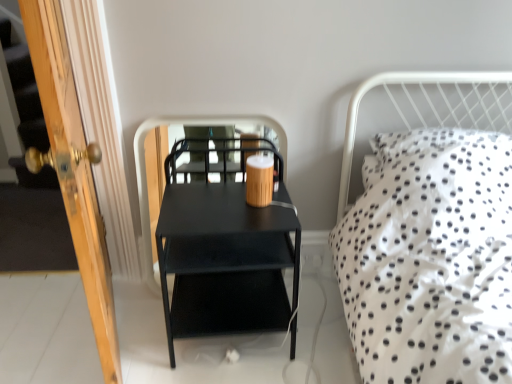
You are a GUI agent. You are given a task and a screenshot of the screen. Output one action in this format:
    pyautogui.click(x=<x>, y=<y>)
    Task: Click on the vacant space that is to the left of wooden door at left
    The width and height of the screenshot is (512, 384).
    Given the screenshot: What is the action you would take?
    pyautogui.click(x=49, y=326)